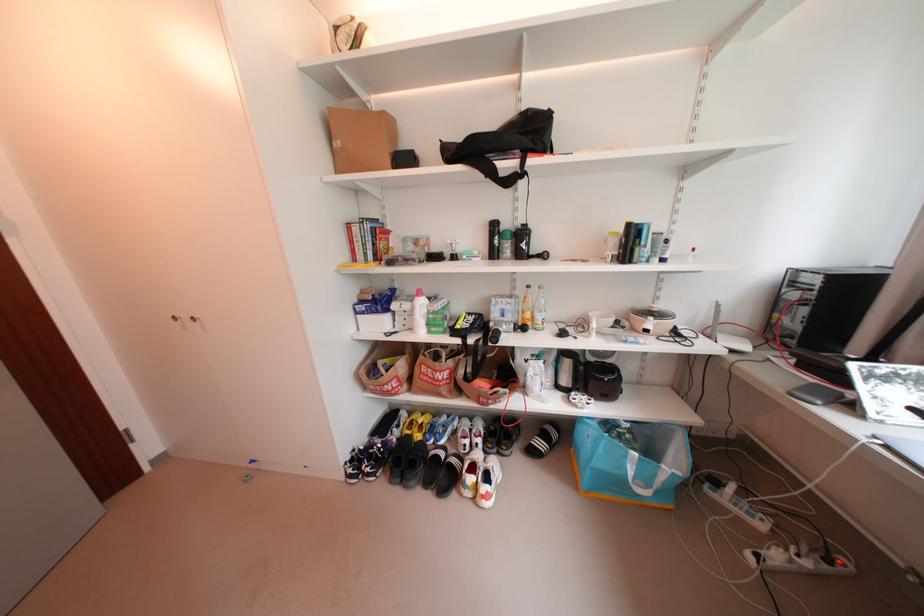
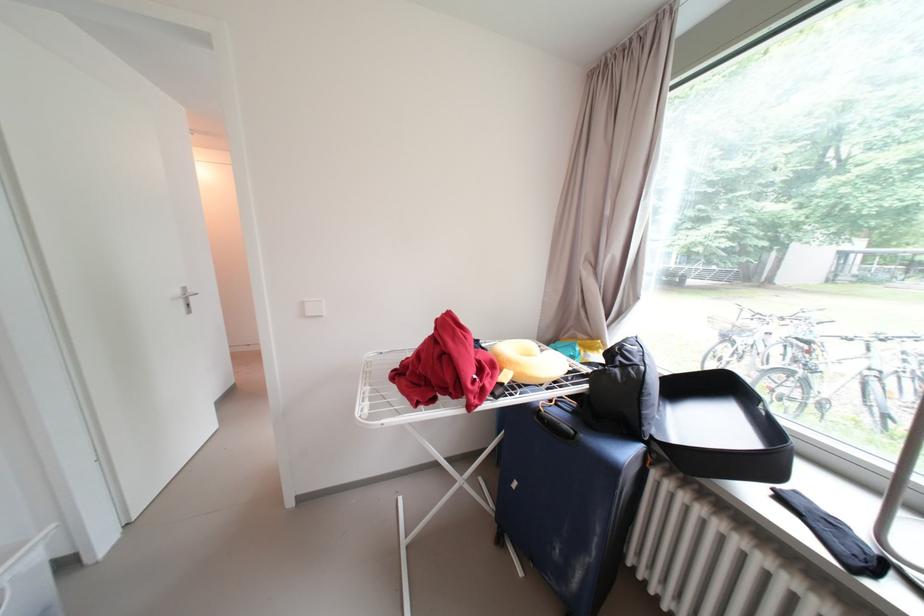
Question: I am providing you with two images of the same scene from different viewpoints. Please identify which objects are invisible in image2.

Choices:
 (A) pot lid handle
 (B) suitcase handle
 (C) open suitcase lid
 (D) container lid clip

Answer: (A)